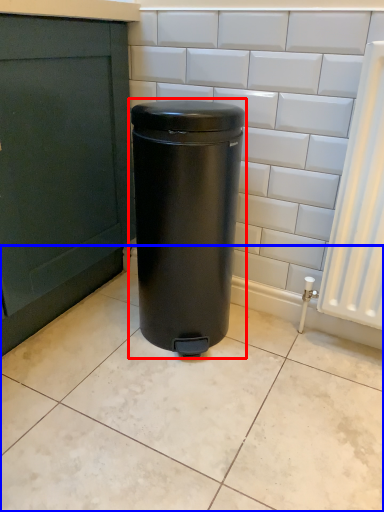
Question: Which of the following is the farthest to the observer, waste container (highlighted by a red box) or ceramic tile (highlighted by a blue box)?

Choices:
 (A) waste container
 (B) ceramic tile

Answer: (A)